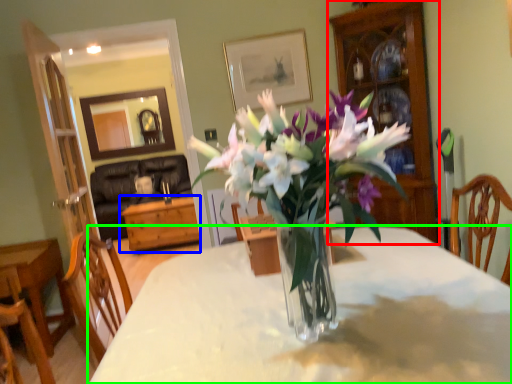
Question: Which is farther away from cabinetry (highlighted by a red box)? table (highlighted by a blue box) or desk (highlighted by a green box)?

Choices:
 (A) table
 (B) desk

Answer: (A)